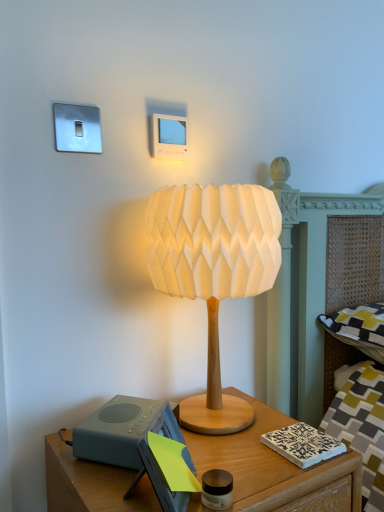
Question: Is wooden nightstand at lower center positioned with its back to gray matte speaker at lower left?

Choices:
 (A) no
 (B) yes

Answer: (A)

Question: From the image's perspective, is wooden nightstand at lower center on gray matte speaker at lower left?

Choices:
 (A) yes
 (B) no

Answer: (B)

Question: Is wooden nightstand at lower center positioned beyond the bounds of gray matte speaker at lower left?

Choices:
 (A) no
 (B) yes

Answer: (B)

Question: Are wooden nightstand at lower center and gray matte speaker at lower left located far from each other?

Choices:
 (A) yes
 (B) no

Answer: (B)

Question: From the image's perspective, does wooden nightstand at lower center appear lower than gray matte speaker at lower left?

Choices:
 (A) no
 (B) yes

Answer: (B)

Question: Considering the relative positions of wooden nightstand at lower center and gray matte speaker at lower left in the image provided, is wooden nightstand at lower center to the left of gray matte speaker at lower left from the viewer's perspective?

Choices:
 (A) yes
 (B) no

Answer: (B)

Question: Could you tell me if white paper lampshade at center is facing wooden nightstand at lower center?

Choices:
 (A) yes
 (B) no

Answer: (B)

Question: Is white paper lampshade at center far away from wooden nightstand at lower center?

Choices:
 (A) no
 (B) yes

Answer: (A)

Question: Is wooden nightstand at lower center surrounded by white paper lampshade at center?

Choices:
 (A) yes
 (B) no

Answer: (B)

Question: Are white paper lampshade at center and wooden nightstand at lower center beside each other?

Choices:
 (A) no
 (B) yes

Answer: (A)

Question: Is white paper lampshade at center completely or partially outside of wooden nightstand at lower center?

Choices:
 (A) no
 (B) yes

Answer: (B)

Question: Considering the relative sizes of white paper lampshade at center and wooden nightstand at lower center in the image provided, is white paper lampshade at center smaller than wooden nightstand at lower center?

Choices:
 (A) yes
 (B) no

Answer: (A)

Question: From the image's perspective, is wooden nightstand at lower center located beneath white paper lampshade at center?

Choices:
 (A) yes
 (B) no

Answer: (A)